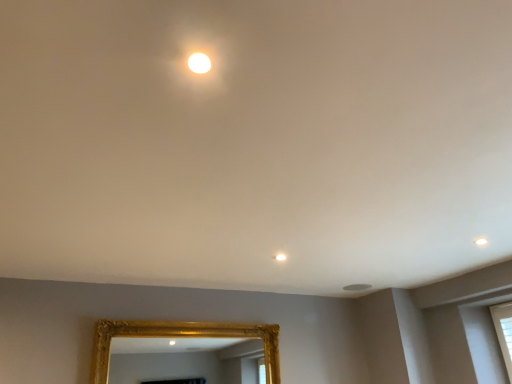
Question: From the image's perspective, is gold textured mirror at lower center above or below matte white light at upper center?

Choices:
 (A) below
 (B) above

Answer: (A)

Question: Is gold textured mirror at lower center situated inside matte white light at upper center or outside?

Choices:
 (A) outside
 (B) inside

Answer: (A)

Question: From a real-world perspective, relative to matte white light at upper center, is gold textured mirror at lower center vertically above or below?

Choices:
 (A) below
 (B) above

Answer: (A)

Question: Is point (479, 238) closer or farther from the camera than point (251, 365)?

Choices:
 (A) closer
 (B) farther

Answer: (A)

Question: Is matte white light at upper center spatially inside gold textured mirror at lower center, or outside of it?

Choices:
 (A) outside
 (B) inside

Answer: (A)

Question: In the image, is matte white light at upper center positioned in front of or behind gold textured mirror at lower center?

Choices:
 (A) front
 (B) behind

Answer: (A)

Question: From the image's perspective, is matte white light at upper center located above or below gold textured mirror at lower center?

Choices:
 (A) above
 (B) below

Answer: (A)